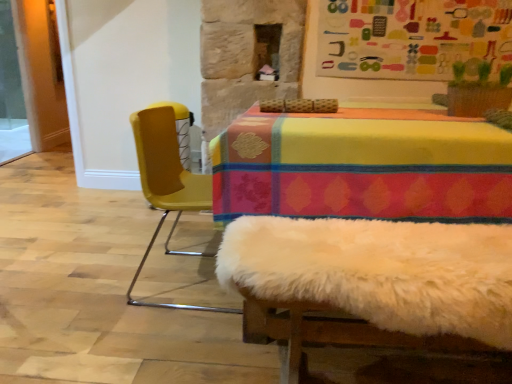
Identify the location of vacant space underneath yellow plastic chair at left (from a real-world perspective). The image size is (512, 384). (192, 283).